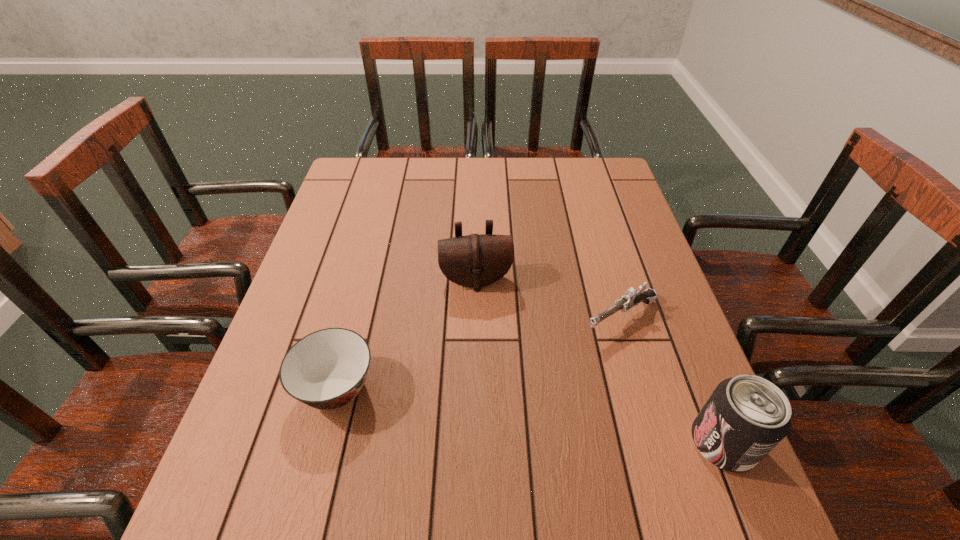
Where is `vacant spot on the desktop that is between the soup bowl and the soda can and is positioned with the flap open on the pouch`? The height and width of the screenshot is (540, 960). vacant spot on the desktop that is between the soup bowl and the soda can and is positioned with the flap open on the pouch is located at coordinates (494, 411).

Where is `free spot on the desktop that is between the leftmost object and the soda can and is positioned aimed along the barrel of the gun`? The width and height of the screenshot is (960, 540). free spot on the desktop that is between the leftmost object and the soda can and is positioned aimed along the barrel of the gun is located at coordinates (481, 409).